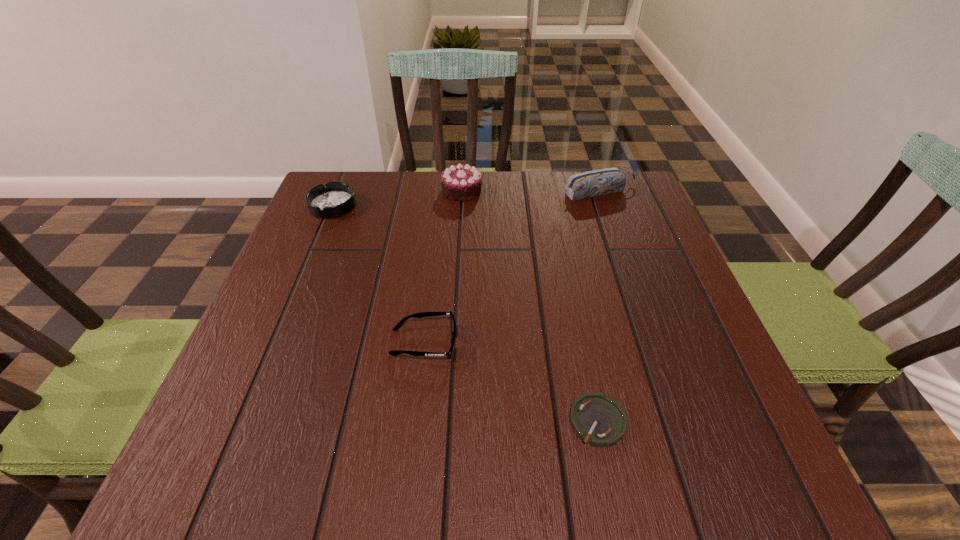
Where is `free space between the fourth farthest object and the chocolate cake`? free space between the fourth farthest object and the chocolate cake is located at coordinates (443, 266).

Locate an element on the screen. This screenshot has width=960, height=540. free space between the second nearest object and the chocolate cake is located at coordinates (443, 266).

I want to click on free spot between the second nearest object and the chocolate cake, so click(443, 266).

Where is `free spot between the fourth farthest object and the left ashtray`? free spot between the fourth farthest object and the left ashtray is located at coordinates click(378, 274).

This screenshot has height=540, width=960. I want to click on empty space between the sunglasses and the chocolate cake, so click(443, 266).

Locate an element on the screen. The height and width of the screenshot is (540, 960). object that can be found as the fourth closest to the sunglasses is located at coordinates (599, 182).

You are a GUI agent. You are given a task and a screenshot of the screen. Output one action in this format:
    pyautogui.click(x=<x>, y=<y>)
    Task: Click on the closest object to the right ashtray
    The width and height of the screenshot is (960, 540).
    Given the screenshot: What is the action you would take?
    pyautogui.click(x=423, y=314)

Where is `vacant space that satisfies the following two spatial constraints: 1. on the front-facing side of the fourth farthest object; 2. on the left side of the shortest object`? The height and width of the screenshot is (540, 960). vacant space that satisfies the following two spatial constraints: 1. on the front-facing side of the fourth farthest object; 2. on the left side of the shortest object is located at coordinates (415, 421).

You are a GUI agent. You are given a task and a screenshot of the screen. Output one action in this format:
    pyautogui.click(x=<x>, y=<y>)
    Task: Click on the vacant space that satisfies the following two spatial constraints: 1. on the back side of the shorter ashtray; 2. on the front-facing side of the sunglasses
    This screenshot has width=960, height=540.
    Given the screenshot: What is the action you would take?
    pyautogui.click(x=581, y=342)

At what (x,y) coordinates should I click in order to perform the action: click on blank area in the image that satisfies the following two spatial constraints: 1. on the back side of the shorter ashtray; 2. on the left side of the fourth shortest object. Please return your answer as a coordinate pair (x, y). Image resolution: width=960 pixels, height=540 pixels. Looking at the image, I should click on (550, 192).